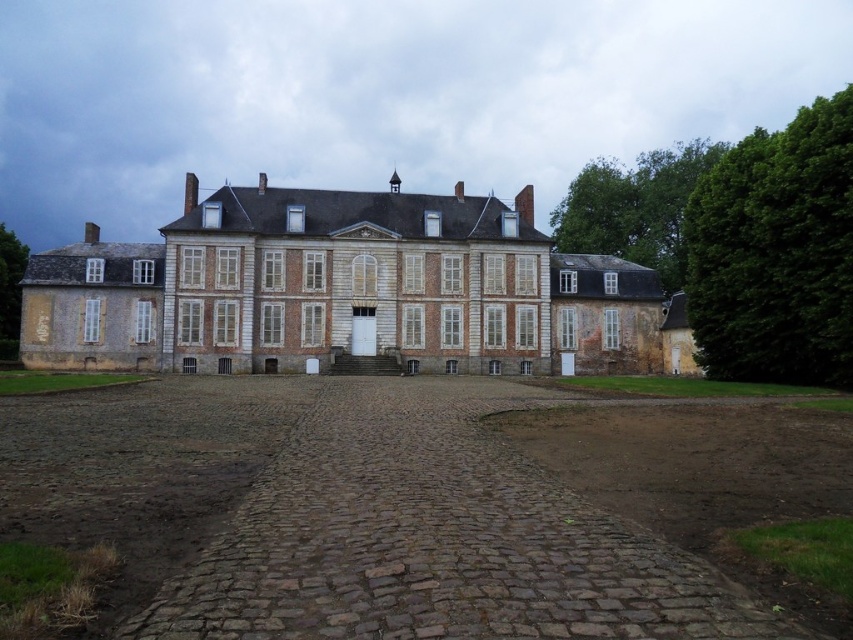
Question: Among these points, which one is farthest from the camera?

Choices:
 (A) pos(202,637)
 (B) pos(604,220)

Answer: (B)

Question: Which of the following is the farthest from the observer?

Choices:
 (A) (599, 236)
 (B) (7, 234)
 (C) (474, 244)
 (D) (758, 241)

Answer: (A)

Question: Is brown cobblestone driveway at center bigger than green leafy tree at right?

Choices:
 (A) yes
 (B) no

Answer: (B)

Question: Which point is closer to the camera?

Choices:
 (A) white brick mansion at center
 (B) brown cobblestone driveway at center
 (C) green leafy tree at right
 (D) green leafy tree at left

Answer: (B)

Question: Can you confirm if white brick mansion at center is positioned to the left of green leafy tree at upper right?

Choices:
 (A) yes
 (B) no

Answer: (A)

Question: Does white brick mansion at center appear on the right side of green leafy tree at upper right?

Choices:
 (A) yes
 (B) no

Answer: (B)